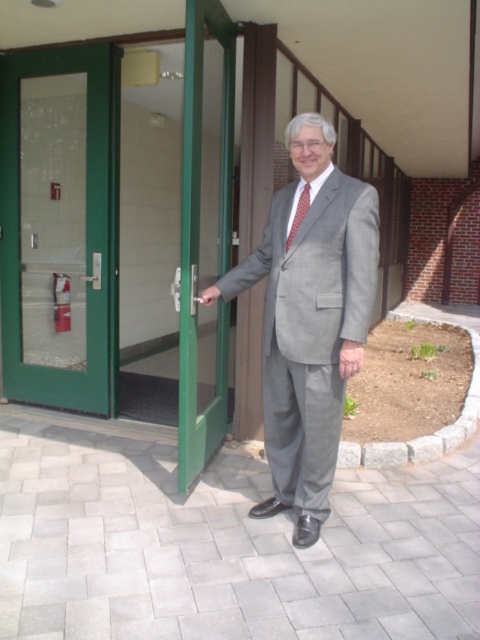
You are a delivery person standing at the entrance of the building. You need to hand over a package to the man in the gray wool suit at center. The delivery requires you to be within 5 feet of him. Can you reach him without moving past the green glass door at left?

The green glass door at left is 6.44 feet away from the gray wool suit at center. Since the required distance is 5 feet, you are 1.44 feet too far to reach him without moving past the green glass door at left.

The man is wearing a gray wool suit at center and a red dotted tie at center. Which clothing item is positioned to the left?

The gray wool suit at center is positioned to the left of the red dotted tie at center.

You are standing at the entrance of the building and want to determine which of the two points, point (97, 264) or point (298, 209), is closer to you. Based on the scene description, which point is nearer?

Point (97, 264) is closer to you because it is further to the viewer than point (298, 209).